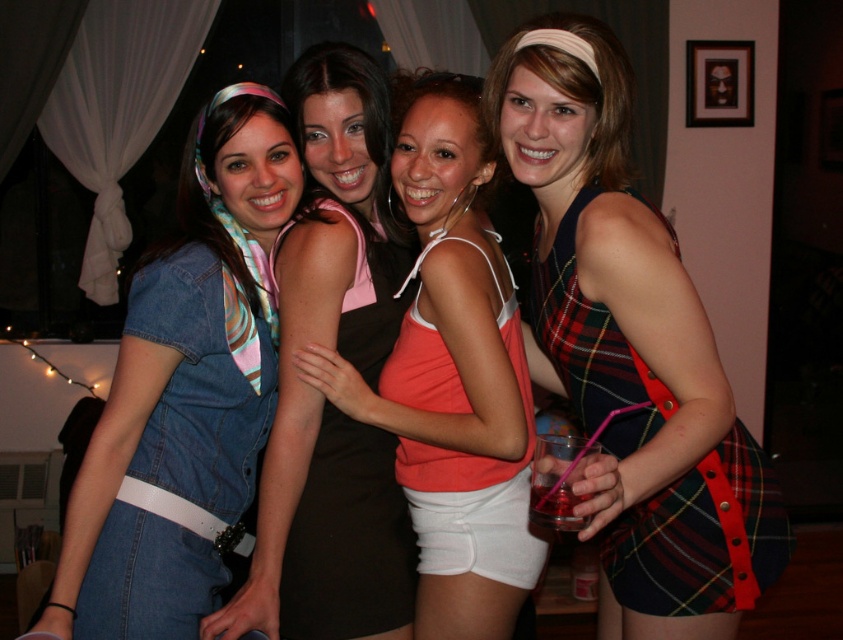
You are at the point marked as point (184, 394) in the image. What object is located exactly at that point?

The denim dress at left is located exactly at point (184, 394).

You are planning to take a photo of the denim dress at left and the black satin dress at center. Which dress should you focus on first if you want to capture both in the frame without moving the camera?

The denim dress at left should be focused on first because it is larger than the black satin dress at center, allowing you to ensure it fits within the frame while still capturing the smaller dress.

You are planning to buy a dress similar to the ones in the image. The denim dress at left and the black satin dress at center are both options. Based on their widths, which dress would you choose if you prefer a wider silhouette?

The denim dress at left has a wider silhouette than the black satin dress at center, so you should choose the denim dress at left if you prefer a wider silhouette.